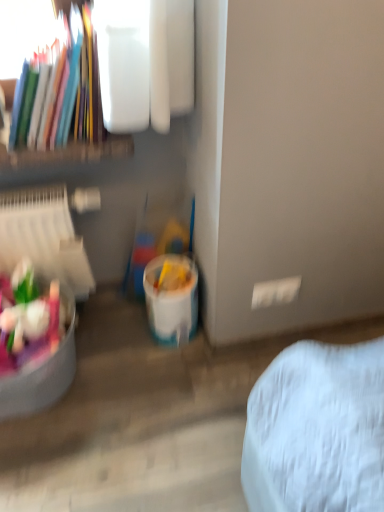
Question: Is white plastic bucket at lower center wider than matte plastic toys at lower left?

Choices:
 (A) no
 (B) yes

Answer: (A)

Question: Is white plastic bucket at lower center completely or partially outside of matte plastic toys at lower left?

Choices:
 (A) no
 (B) yes

Answer: (B)

Question: Is white plastic bucket at lower center looking in the opposite direction of matte plastic toys at lower left?

Choices:
 (A) yes
 (B) no

Answer: (B)

Question: From the image's perspective, would you say white plastic bucket at lower center is shown under matte plastic toys at lower left?

Choices:
 (A) no
 (B) yes

Answer: (A)

Question: Considering the relative positions of white plastic bucket at lower center and matte plastic toys at lower left in the image provided, is white plastic bucket at lower center to the left of matte plastic toys at lower left from the viewer's perspective?

Choices:
 (A) yes
 (B) no

Answer: (B)

Question: Are white plastic bucket at lower center and matte plastic toys at lower left located far from each other?

Choices:
 (A) no
 (B) yes

Answer: (A)

Question: Is matte plastic books at upper left not near matte plastic toys at lower left?

Choices:
 (A) yes
 (B) no

Answer: (B)

Question: Is matte plastic toys at lower left at the back of matte plastic books at upper left?

Choices:
 (A) no
 (B) yes

Answer: (A)

Question: Considering the relative sizes of matte plastic books at upper left and matte plastic toys at lower left in the image provided, is matte plastic books at upper left wider than matte plastic toys at lower left?

Choices:
 (A) no
 (B) yes

Answer: (A)

Question: Can you confirm if matte plastic books at upper left is smaller than matte plastic toys at lower left?

Choices:
 (A) no
 (B) yes

Answer: (A)

Question: Is matte plastic books at upper left to the right of matte plastic toys at lower left from the viewer's perspective?

Choices:
 (A) no
 (B) yes

Answer: (B)

Question: Could you tell me if matte plastic books at upper left is facing matte plastic toys at lower left?

Choices:
 (A) no
 (B) yes

Answer: (A)

Question: Considering the relative positions of matte plastic toys at lower left and matte plastic books at upper left in the image provided, is matte plastic toys at lower left in front of matte plastic books at upper left?

Choices:
 (A) yes
 (B) no

Answer: (B)